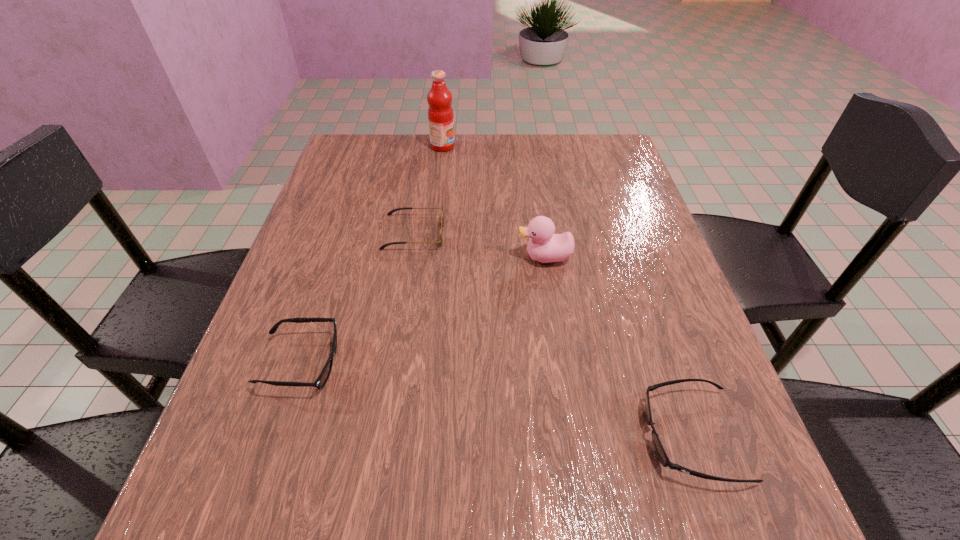
Image resolution: width=960 pixels, height=540 pixels. I want to click on blank space located 0.280m on the front-facing side of the fourth object from left to right, so click(388, 257).

This screenshot has height=540, width=960. I want to click on vacant space located on the front-facing side of the leftmost object, so click(x=430, y=363).

In order to click on vacant region located 0.390m on the front-facing side of the farthest sunglasses in this screenshot , I will do `click(613, 232)`.

At what (x,y) coordinates should I click in order to perform the action: click on free space located on the front-facing side of the rightmost sunglasses. Please return your answer as a coordinate pair (x, y). This screenshot has width=960, height=540. Looking at the image, I should click on (431, 435).

Where is `vacant region located on the front-facing side of the rightmost sunglasses`? This screenshot has height=540, width=960. vacant region located on the front-facing side of the rightmost sunglasses is located at coordinates (405, 435).

In order to click on vacant space located 0.380m on the front-facing side of the rightmost sunglasses in this screenshot , I will do `click(398, 435)`.

At what (x,y) coordinates should I click in order to perform the action: click on object that is at the far edge. Please return your answer as a coordinate pair (x, y). Looking at the image, I should click on (440, 112).

Find the location of a particular element. Image resolution: width=960 pixels, height=540 pixels. object present at the near edge is located at coordinates (659, 450).

Where is `object that is positioned at the left edge`? This screenshot has width=960, height=540. object that is positioned at the left edge is located at coordinates (322, 379).

This screenshot has height=540, width=960. What are the coordinates of `object positioned at the right edge` in the screenshot? It's located at (659, 450).